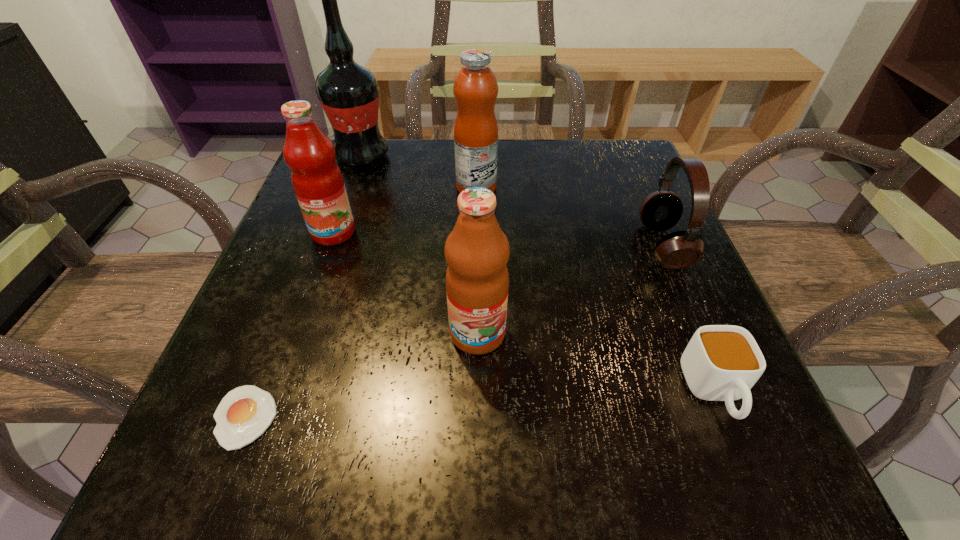
You are a GUI agent. You are given a task and a screenshot of the screen. Output one action in this format:
    pyautogui.click(x=<x>, y=<y>)
    Task: Click on the vacant area that lies between the nearest fruit juice and the leftmost fruit juice
    The height and width of the screenshot is (540, 960).
    Given the screenshot: What is the action you would take?
    pyautogui.click(x=405, y=283)

Image resolution: width=960 pixels, height=540 pixels. What are the coordinates of `unoccupied position between the nearest fruit juice and the cup` in the screenshot? It's located at (596, 363).

At what (x,y) coordinates should I click in order to perform the action: click on unoccupied position between the nearest fruit juice and the headset. Please return your answer as a coordinate pair (x, y). This screenshot has height=540, width=960. Looking at the image, I should click on (570, 289).

Identify the location of free space between the leftmost fruit juice and the sixth tallest object. This screenshot has height=540, width=960. (524, 312).

This screenshot has height=540, width=960. I want to click on vacant area that lies between the headset and the nearest fruit juice, so click(570, 289).

Where is `empty space that is in between the sixth tallest object and the leftmost fruit juice`? empty space that is in between the sixth tallest object and the leftmost fruit juice is located at coordinates (524, 312).

Identify which object is the sixth closest to the egg yolk. Please provide its 2D coordinates. Your answer should be formatted as a tuple, i.e. [(x, y)], where the tuple contains the x and y coordinates of a point satisfying the conditions above.

[(661, 210)]

Image resolution: width=960 pixels, height=540 pixels. Identify the location of object that stands as the closest to the farthest fruit juice. (348, 92).

Identify the location of the second closest fruit juice relative to the nearest fruit juice. The image size is (960, 540). (475, 88).

This screenshot has height=540, width=960. Identify the location of fruit juice identified as the closest to the headset. [x=475, y=88].